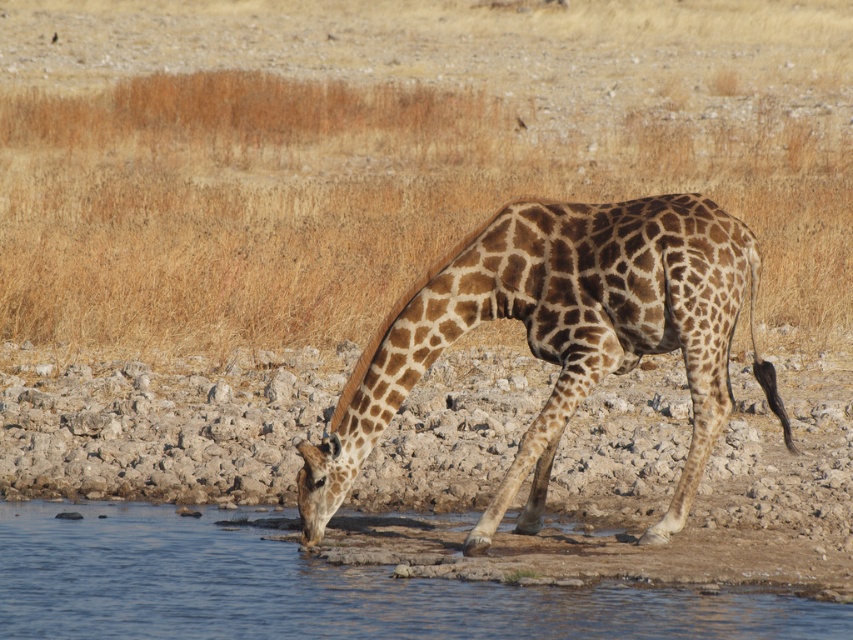
You are standing at the point with coordinates point (592, 611) and want to walk to the point with coordinates point (334, 465). Which direction should you face to walk towards your destination?

You should face north to walk towards point (334, 465) from point (592, 611) because point (334, 465) is behind point (592, 611).

You are a photographer trying to capture the giraffe drinking water. Based on the scene, where should you position yourself to ensure the spotted fur giraffe at center is visible above the brown dry grass at center?

The brown dry grass at center is located above the spotted fur giraffe at center, so you should position yourself higher to ensure the giraffe is visible above the grass.

You are a photographer standing at the edge of the water. You want to capture a photo of the brown dry grass at center and the clear water at lower left. Which object is closer to your camera lens?

The brown dry grass at center is closer to the camera lens because it is further to the viewer than the clear water at lower left, meaning it occupies a nearer position in the scene.